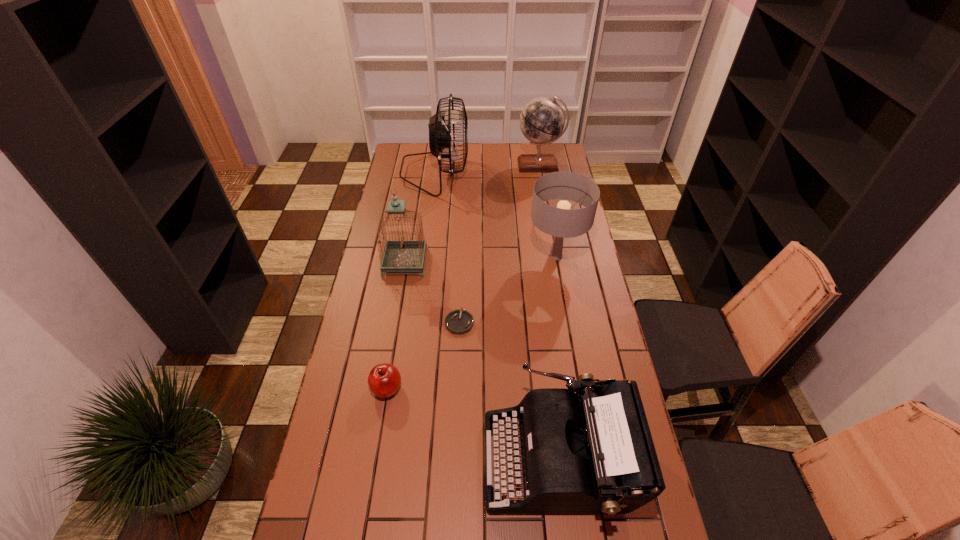
Where is `blank region between the globe and the apple`? blank region between the globe and the apple is located at coordinates (463, 276).

What are the coordinates of `vacant space in between the lampshade and the typewriter` in the screenshot? It's located at 558,357.

Where is `free point between the birdcage and the lampshade`? Image resolution: width=960 pixels, height=540 pixels. free point between the birdcage and the lampshade is located at coordinates (481, 259).

Where is `empty space that is in between the ashtray and the lampshade`? Image resolution: width=960 pixels, height=540 pixels. empty space that is in between the ashtray and the lampshade is located at coordinates (508, 289).

Where is `free spot between the typewriter and the fan`? The width and height of the screenshot is (960, 540). free spot between the typewriter and the fan is located at coordinates (497, 315).

This screenshot has height=540, width=960. I want to click on vacant point located between the shortest object and the fifth tallest object, so 509,390.

At what (x,y) coordinates should I click in order to perform the action: click on free spot between the apple and the third shortest object. Please return your answer as a coordinate pair (x, y). This screenshot has height=540, width=960. Looking at the image, I should click on (473, 423).

Identify which object is located as the fifth nearest to the sixth tallest object. Please provide its 2D coordinates. Your answer should be formatted as a tuple, i.e. [(x, y)], where the tuple contains the x and y coordinates of a point satisfying the conditions above.

[(441, 135)]

Identify the location of object that stands as the second closest to the globe. (561, 222).

Find the location of `blank area in the image that satisfies the following two spatial constraints: 1. at the door of the birdcage; 2. on the right side of the apple`. blank area in the image that satisfies the following two spatial constraints: 1. at the door of the birdcage; 2. on the right side of the apple is located at coordinates (384, 388).